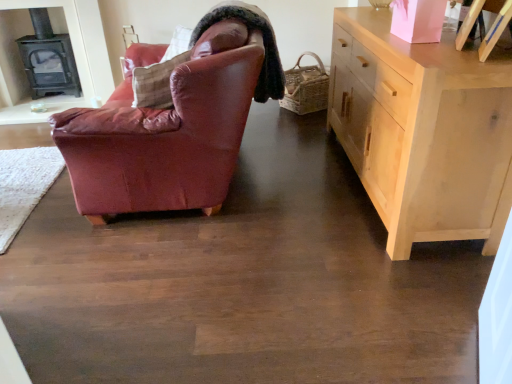
Identify the location of light wood cabinet at right. (423, 131).

The height and width of the screenshot is (384, 512). What are the coordinates of `black cast iron fireplace at upper left` in the screenshot? It's located at (48, 58).

Image resolution: width=512 pixels, height=384 pixels. What do you see at coordinates (183, 62) in the screenshot?
I see `leather-like brown pillow at upper center` at bounding box center [183, 62].

Identify the location of light wood cabinet at right. [423, 131].

Consider the image. From the image's perspective, which object appears higher, leather-like brown pillow at upper center or light wood cabinet at right?

leather-like brown pillow at upper center, from the image's perspective.

Considering the relative sizes of leather-like brown pillow at upper center and light wood cabinet at right in the image provided, is leather-like brown pillow at upper center smaller than light wood cabinet at right?

Indeed, leather-like brown pillow at upper center has a smaller size compared to light wood cabinet at right.

You are a GUI agent. You are given a task and a screenshot of the screen. Output one action in this format:
    pyautogui.click(x=<x>, y=<y>)
    Task: Click on the pillow to the left of light wood cabinet at right
    The width and height of the screenshot is (512, 384).
    Given the screenshot: What is the action you would take?
    pyautogui.click(x=183, y=62)

Which is behind, point (213, 36) or point (405, 176)?

Point (213, 36)

From a real-world perspective, which object rests below the other?

light wood cabinet at right, from a real-world perspective.

Could you tell me if light wood cabinet at right is turned towards leather-like brown pillow at upper center?

Yes, light wood cabinet at right is facing leather-like brown pillow at upper center.

In the scene shown: Is light wood cabinet at right to the left or to the right of leather-like brown pillow at upper center in the image?

From the image, it's evident that light wood cabinet at right is to the right of leather-like brown pillow at upper center.

Can you confirm if light wood cabinet at right is shorter than leather-like brown pillow at upper center?

No.

From a real-world perspective, is leather-like brown pillow at upper center beneath black cast iron fireplace at upper left?

Actually, leather-like brown pillow at upper center is physically above black cast iron fireplace at upper left in the real world.

Can you tell me how much leather-like brown pillow at upper center and black cast iron fireplace at upper left differ in facing direction?

They differ by 50.8 degrees in their facing directions.

Is leather-like brown pillow at upper center at the right side of black cast iron fireplace at upper left?

Yes, leather-like brown pillow at upper center is to the right of black cast iron fireplace at upper left.

You are a GUI agent. You are given a task and a screenshot of the screen. Output one action in this format:
    pyautogui.click(x=<x>, y=<y>)
    Task: Click on the pillow lying in front of the black cast iron fireplace at upper left
    Image resolution: width=512 pixels, height=384 pixels.
    Given the screenshot: What is the action you would take?
    pyautogui.click(x=183, y=62)

Is point (32, 8) behind point (212, 50)?

That is True.

Considering the relative sizes of black cast iron fireplace at upper left and leather-like brown pillow at upper center in the image provided, is black cast iron fireplace at upper left taller than leather-like brown pillow at upper center?

Yes.

From the image's perspective, relative to leather-like brown pillow at upper center, is black cast iron fireplace at upper left above or below?

From the image's perspective, black cast iron fireplace at upper left appears above leather-like brown pillow at upper center.

What are the coordinates of `fireplace that appears above the leather-like brown pillow at upper center (from the image's perspective)` in the screenshot? It's located at (48, 58).

Is black cast iron fireplace at upper left aimed at light wood cabinet at right?

No, black cast iron fireplace at upper left is not oriented towards light wood cabinet at right.

Which of these two, black cast iron fireplace at upper left or light wood cabinet at right, stands shorter?

Standing shorter between the two is black cast iron fireplace at upper left.

Could light wood cabinet at right be considered to be inside black cast iron fireplace at upper left?

No, black cast iron fireplace at upper left does not contain light wood cabinet at right.

From a real-world perspective, which is physically below, light wood cabinet at right or black cast iron fireplace at upper left?

light wood cabinet at right, from a real-world perspective.

Find the location of a particular element. fireplace that appears above the light wood cabinet at right (from the image's perspective) is located at coordinates pyautogui.click(x=48, y=58).

Considering their positions, is light wood cabinet at right located in front of or behind black cast iron fireplace at upper left?

In the image, light wood cabinet at right appears in front of black cast iron fireplace at upper left.

Between light wood cabinet at right and black cast iron fireplace at upper left, which one has less height?

With less height is black cast iron fireplace at upper left.

The width and height of the screenshot is (512, 384). What are the coordinates of `the chest of drawers that appears below the leather-like brown pillow at upper center (from a real-world perspective)` in the screenshot? It's located at (423, 131).

Identify the location of pillow positioned vertically above the light wood cabinet at right (from a real-world perspective). The image size is (512, 384). (183, 62).

Considering their positions, is black cast iron fireplace at upper left positioned further to leather-like brown pillow at upper center than light wood cabinet at right?

black cast iron fireplace at upper left.

Estimate the real-world distances between objects in this image. Which object is closer to black cast iron fireplace at upper left, leather-like brown pillow at upper center or light wood cabinet at right?

Based on the image, leather-like brown pillow at upper center appears to be nearer to black cast iron fireplace at upper left.

Considering their positions, is leather-like brown pillow at upper center positioned further to light wood cabinet at right than black cast iron fireplace at upper left?

black cast iron fireplace at upper left is further to light wood cabinet at right.

When comparing their distances from black cast iron fireplace at upper left, does light wood cabinet at right or leather-like brown pillow at upper center seem closer?

The object closer to black cast iron fireplace at upper left is leather-like brown pillow at upper center.

Which object lies nearer to the anchor point light wood cabinet at right, black cast iron fireplace at upper left or leather-like brown pillow at upper center?

leather-like brown pillow at upper center lies closer to light wood cabinet at right than the other object.

Which object lies nearer to the anchor point leather-like brown pillow at upper center, light wood cabinet at right or black cast iron fireplace at upper left?

Based on the image, light wood cabinet at right appears to be nearer to leather-like brown pillow at upper center.

Where is `pillow between black cast iron fireplace at upper left and light wood cabinet at right in the horizontal direction`? This screenshot has width=512, height=384. pillow between black cast iron fireplace at upper left and light wood cabinet at right in the horizontal direction is located at coordinates (183, 62).